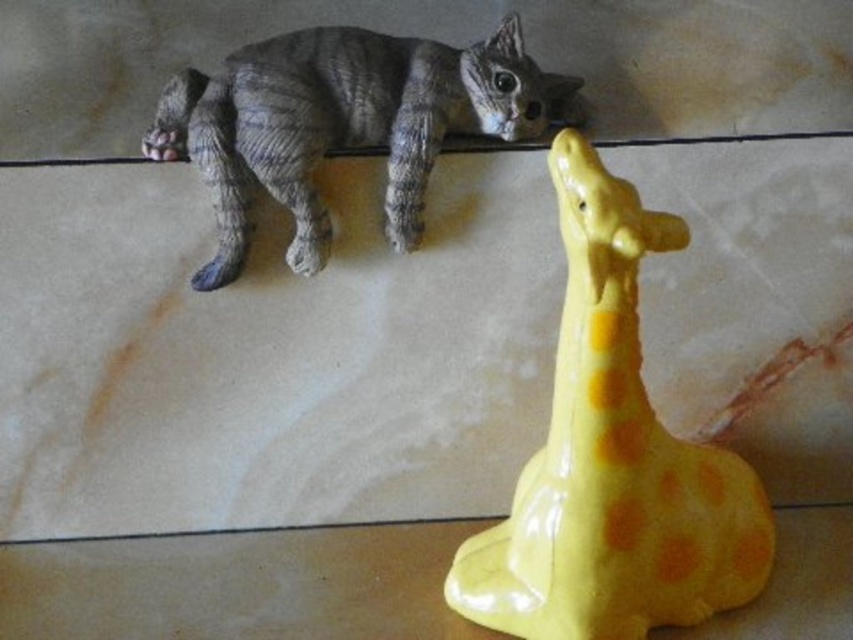
Question: Which point is closer to the camera?

Choices:
 (A) (798, 596)
 (B) (642, 490)
 (C) (498, 35)

Answer: (B)

Question: In this image, where is yellow glossy giraffe at lower right located relative to transparent glass giraffe at lower right?

Choices:
 (A) left
 (B) right

Answer: (B)

Question: Which of these objects is positioned farthest from the gray textured cat at upper center?

Choices:
 (A) transparent glass giraffe at lower right
 (B) yellow glossy giraffe at lower right

Answer: (A)

Question: Can you confirm if yellow glossy giraffe at lower right is positioned to the right of gray textured cat at upper center?

Choices:
 (A) yes
 (B) no

Answer: (A)

Question: Estimate the real-world distances between objects in this image. Which object is farther from the gray textured cat at upper center?

Choices:
 (A) transparent glass giraffe at lower right
 (B) yellow glossy giraffe at lower right

Answer: (A)

Question: Is transparent glass giraffe at lower right below gray textured cat at upper center?

Choices:
 (A) no
 (B) yes

Answer: (B)